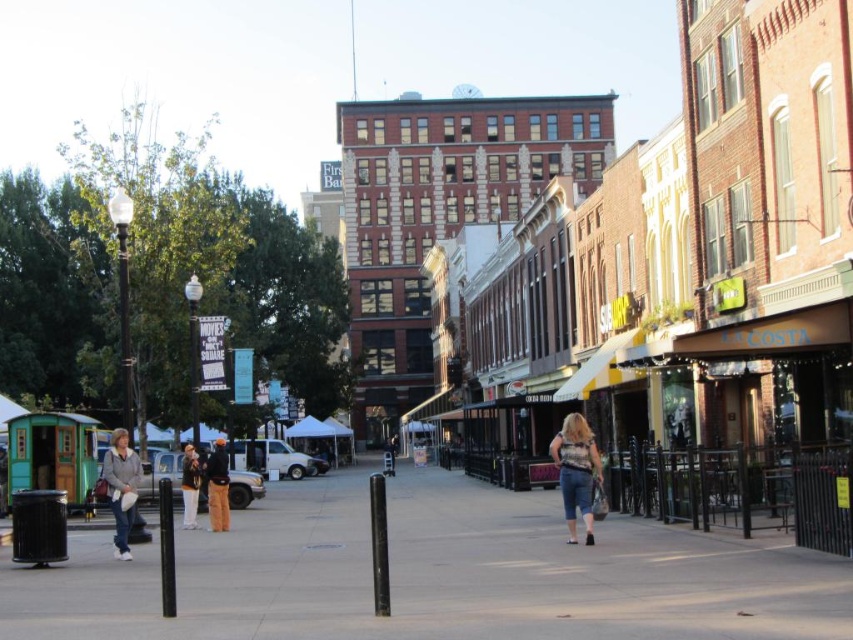
You are standing on the pedestrian walkway and want to reach both the point at coordinates point (463,483) and the point at coordinates point (129,493). Which point do you need to walk towards first to reach the one closer to you?

You should first walk towards point (129,493) because it is farther away from you than point (463,483), which is closer.

Consider the image. You are a delivery robot that needs to place a package on the gray concrete sidewalk at center. However, there is an orange fabric jacket at center nearby. Which object has enough space to accommodate the package?

The gray concrete sidewalk at center has a larger size compared to the orange fabric jacket at center, so the package can be placed on the gray concrete sidewalk at center.